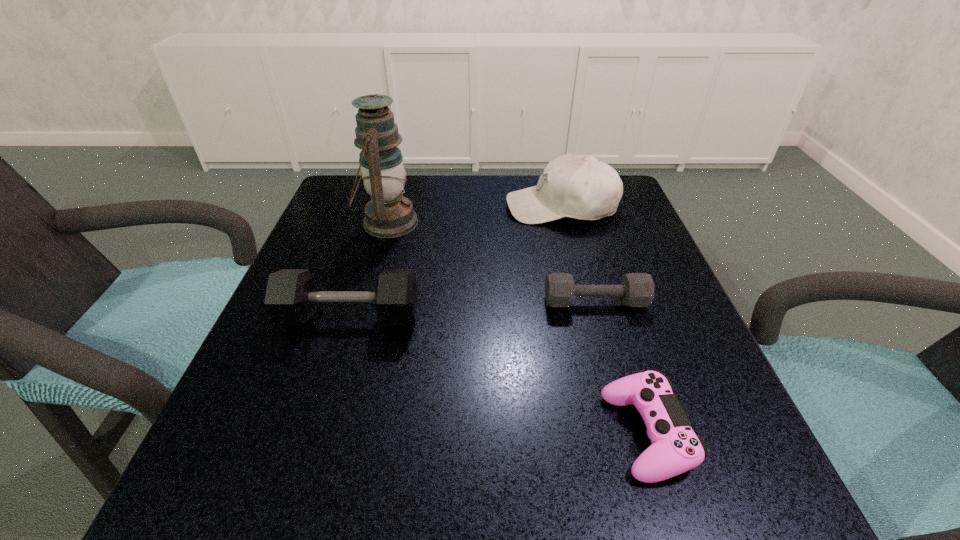
You are a GUI agent. You are given a task and a screenshot of the screen. Output one action in this format:
    pyautogui.click(x=<x>, y=<y>)
    Task: Click on the empty location between the baseball cap and the tallest object
    The width and height of the screenshot is (960, 540).
    Given the screenshot: What is the action you would take?
    pyautogui.click(x=474, y=215)

This screenshot has width=960, height=540. In order to click on vacant area that lies between the baseball cap and the shorter dumbbell in this screenshot , I will do `click(578, 255)`.

Where is `free space between the oil lamp and the fourth shortest object`? free space between the oil lamp and the fourth shortest object is located at coordinates (474, 215).

Identify the location of vacant point located between the nearest object and the baseball cap. The width and height of the screenshot is (960, 540). (604, 320).

Where is `vacant area that lies between the third shortest object and the second tallest object`? The height and width of the screenshot is (540, 960). vacant area that lies between the third shortest object and the second tallest object is located at coordinates (455, 262).

Identify the location of free space between the tallest object and the third tallest object. The width and height of the screenshot is (960, 540). (369, 270).

Where is `free space that is in between the left dumbbell and the tallest object`? Image resolution: width=960 pixels, height=540 pixels. free space that is in between the left dumbbell and the tallest object is located at coordinates (369, 270).

Image resolution: width=960 pixels, height=540 pixels. I want to click on unoccupied position between the right dumbbell and the baseball cap, so click(578, 255).

Locate an element on the screen. The height and width of the screenshot is (540, 960). free space between the baseball cap and the shorter dumbbell is located at coordinates pos(578,255).

Locate an element on the screen. The image size is (960, 540). object that is the fourth nearest to the taller dumbbell is located at coordinates (675, 449).